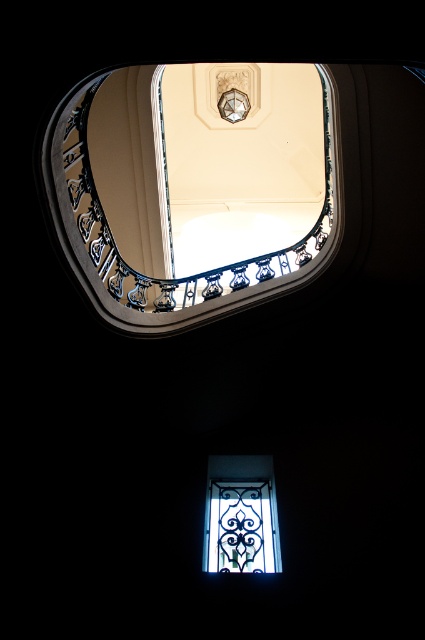
Question: Does clear glass at upper center appear on the right side of clear glass window at lower center?

Choices:
 (A) yes
 (B) no

Answer: (B)

Question: Can you confirm if clear glass at upper center is thinner than clear glass window at lower center?

Choices:
 (A) yes
 (B) no

Answer: (B)

Question: Among these objects, which one is nearest to the camera?

Choices:
 (A) clear glass window at lower center
 (B) clear glass at upper center

Answer: (B)

Question: Which point is farther to the camera?

Choices:
 (A) (265, 259)
 (B) (212, 470)

Answer: (A)

Question: Which point is closer to the camera taking this photo?

Choices:
 (A) (180, 323)
 (B) (238, 465)

Answer: (A)

Question: Is clear glass at upper center positioned behind clear glass window at lower center?

Choices:
 (A) no
 (B) yes

Answer: (A)